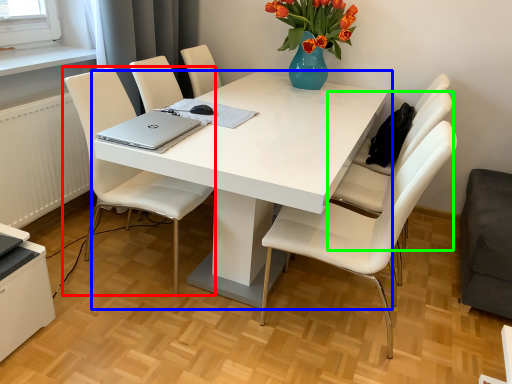
Question: Which is nearer to the chair (highlighted by a red box)? table (highlighted by a blue box) or chair (highlighted by a green box).

Choices:
 (A) table
 (B) chair

Answer: (A)